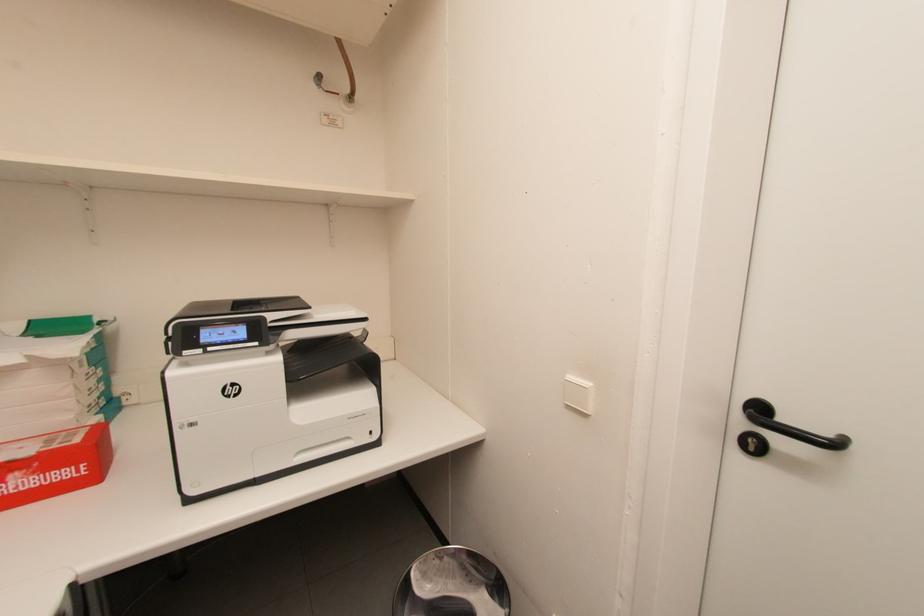
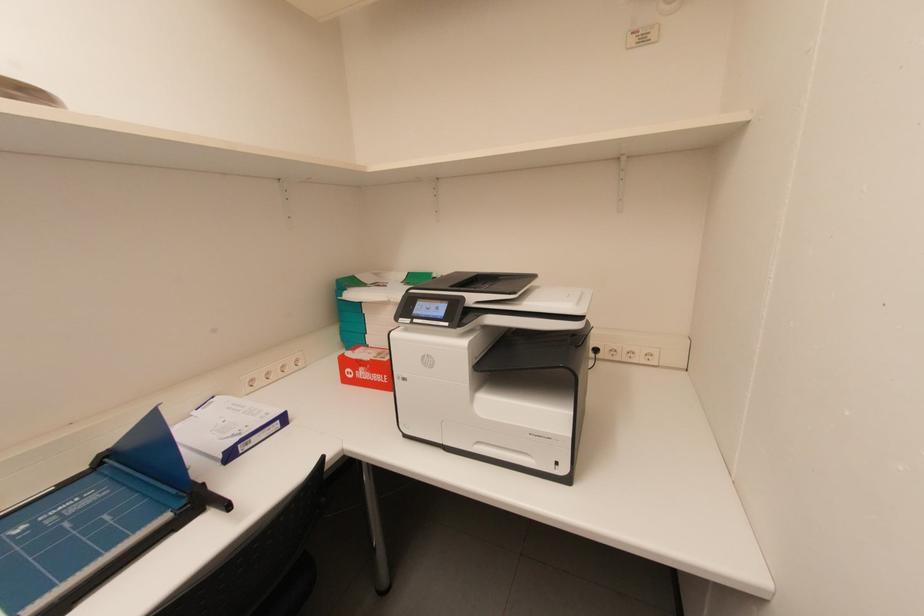
Question: The first image is from the beginning of the video and the second image is from the end. How did the camera likely rotate when shooting the video?

Choices:
 (A) Left
 (B) Right
 (C) Up
 (D) Down

Answer: (A)